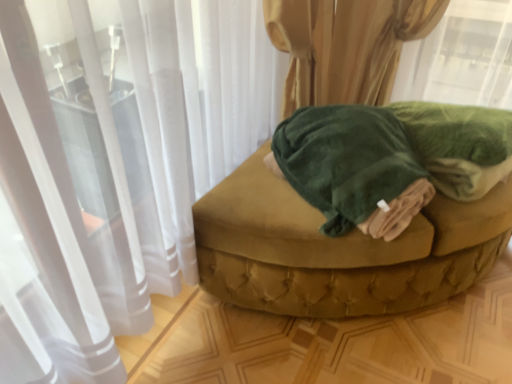
Question: Is velvet green ottoman at center not close to green plush bath towel at center?

Choices:
 (A) yes
 (B) no

Answer: (B)

Question: From a real-world perspective, is velvet green ottoman at center on green plush bath towel at center?

Choices:
 (A) yes
 (B) no

Answer: (B)

Question: Can you see velvet green ottoman at center touching green plush bath towel at center?

Choices:
 (A) yes
 (B) no

Answer: (B)

Question: Does velvet green ottoman at center have a lesser height compared to green plush bath towel at center?

Choices:
 (A) no
 (B) yes

Answer: (A)

Question: Does velvet green ottoman at center turn towards green plush bath towel at center?

Choices:
 (A) no
 (B) yes

Answer: (A)

Question: Can you confirm if velvet green ottoman at center is positioned to the left of green plush bath towel at center?

Choices:
 (A) no
 (B) yes

Answer: (A)

Question: From a real-world perspective, does green plush bath towel at center sit lower than velvet green ottoman at center?

Choices:
 (A) yes
 (B) no

Answer: (B)

Question: Considering the relative sizes of green plush bath towel at center and velvet green ottoman at center in the image provided, is green plush bath towel at center bigger than velvet green ottoman at center?

Choices:
 (A) yes
 (B) no

Answer: (B)

Question: Is green plush bath towel at center directly adjacent to velvet green ottoman at center?

Choices:
 (A) yes
 (B) no

Answer: (B)

Question: Considering the relative sizes of green plush bath towel at center and velvet green ottoman at center in the image provided, is green plush bath towel at center wider than velvet green ottoman at center?

Choices:
 (A) no
 (B) yes

Answer: (A)

Question: Considering the relative sizes of green plush bath towel at center and velvet green ottoman at center in the image provided, is green plush bath towel at center taller than velvet green ottoman at center?

Choices:
 (A) yes
 (B) no

Answer: (B)

Question: Can you confirm if green plush bath towel at center is shorter than velvet green ottoman at center?

Choices:
 (A) yes
 (B) no

Answer: (A)

Question: Considering the relative positions of velvet green ottoman at center and green plush bath towel at center in the image provided, is velvet green ottoman at center to the left or to the right of green plush bath towel at center?

Choices:
 (A) right
 (B) left

Answer: (A)